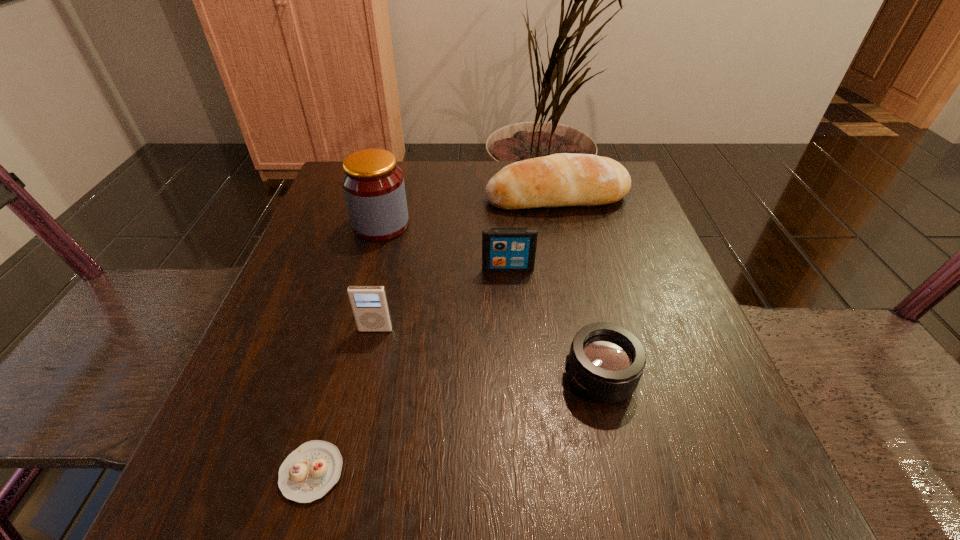
The width and height of the screenshot is (960, 540). What are the coordinates of `free space at the left edge of the desktop` in the screenshot? It's located at (330, 262).

Where is `free spot at the right edge of the desktop`? Image resolution: width=960 pixels, height=540 pixels. free spot at the right edge of the desktop is located at coordinates (619, 242).

In the image, there is a desktop. What are the coordinates of `free space at the far left corner` in the screenshot? It's located at coord(338,171).

You are a GUI agent. You are given a task and a screenshot of the screen. Output one action in this format:
    pyautogui.click(x=<x>, y=<y>)
    Task: Click on the vacant space at the far right corner of the desktop
    
    Given the screenshot: What is the action you would take?
    pyautogui.click(x=587, y=208)

At what (x,y) coordinates should I click in order to perform the action: click on free space at the near right corner. Please return your answer as a coordinate pair (x, y). Looking at the image, I should click on (708, 468).

Identify the location of empty space that is in between the jar and the bread. (468, 211).

Locate an element on the screen. The image size is (960, 540). free space between the shortest object and the third farthest object is located at coordinates (410, 370).

The height and width of the screenshot is (540, 960). What are the coordinates of `vacant region between the nearest object and the jar` in the screenshot? It's located at (347, 348).

What are the coordinates of `unoccupied area between the bread and the fifth tallest object` in the screenshot? It's located at (578, 287).

Identify the location of free space between the fourth farthest object and the tallest object. Image resolution: width=960 pixels, height=540 pixels. (378, 277).